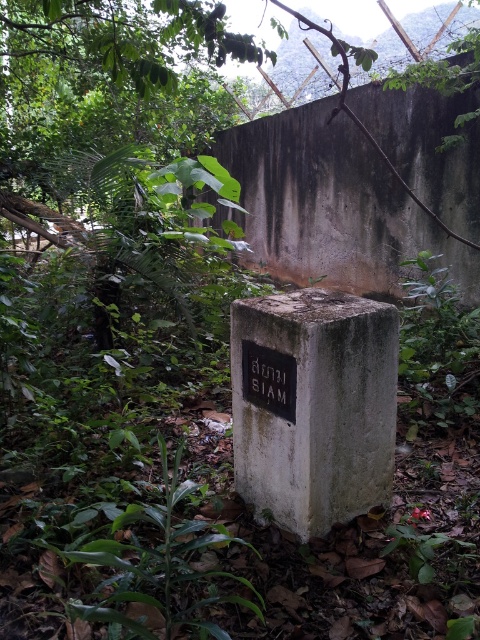
Question: Can you confirm if gray concrete block at center is thinner than black matte plaque at center?

Choices:
 (A) yes
 (B) no

Answer: (B)

Question: From the image, what is the correct spatial relationship of gray concrete block at center in relation to black matte plaque at center?

Choices:
 (A) left
 (B) right

Answer: (B)

Question: Among these objects, which one is nearest to the camera?

Choices:
 (A) gray concrete block at center
 (B) black matte plaque at center

Answer: (A)

Question: Is gray concrete block at center to the right of black matte plaque at center from the viewer's perspective?

Choices:
 (A) no
 (B) yes

Answer: (B)